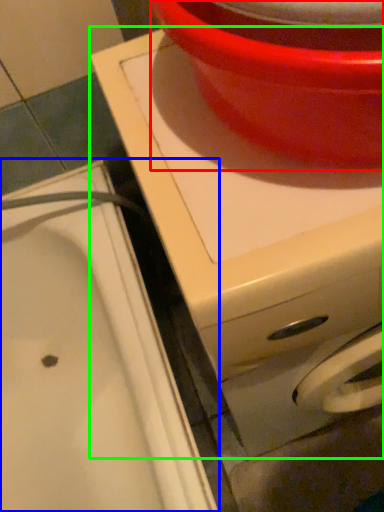
Question: Which is farther away from basin (highlighted by a red box)? sink (highlighted by a blue box) or appliance (highlighted by a green box)?

Choices:
 (A) sink
 (B) appliance

Answer: (A)